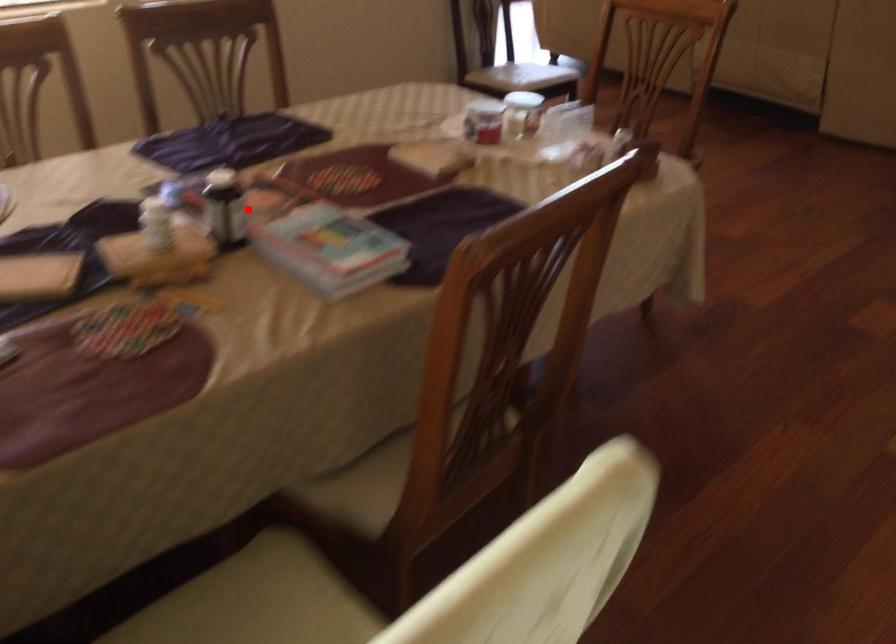
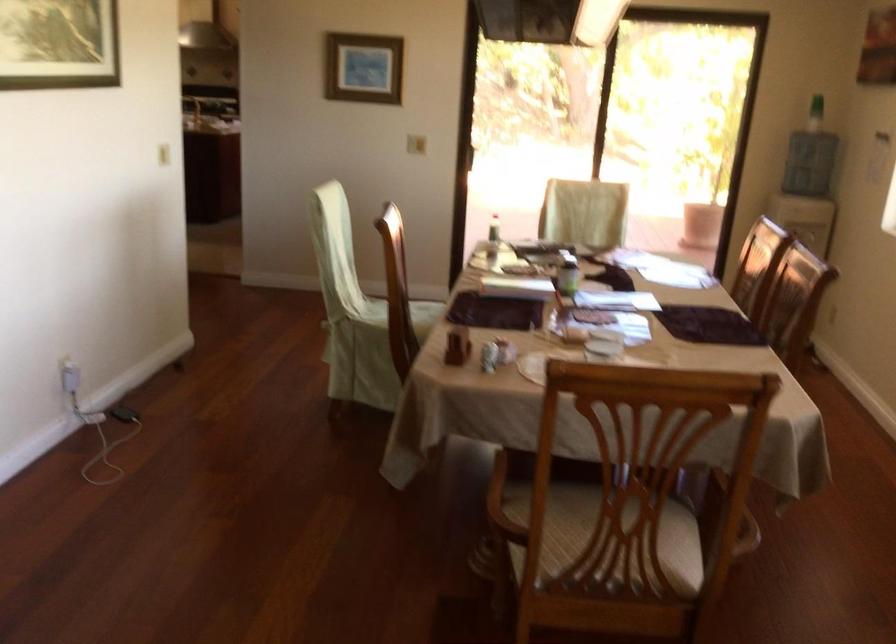
The point at the highlighted location is marked in the first image. Where is the corresponding point in the second image?

(566, 272)